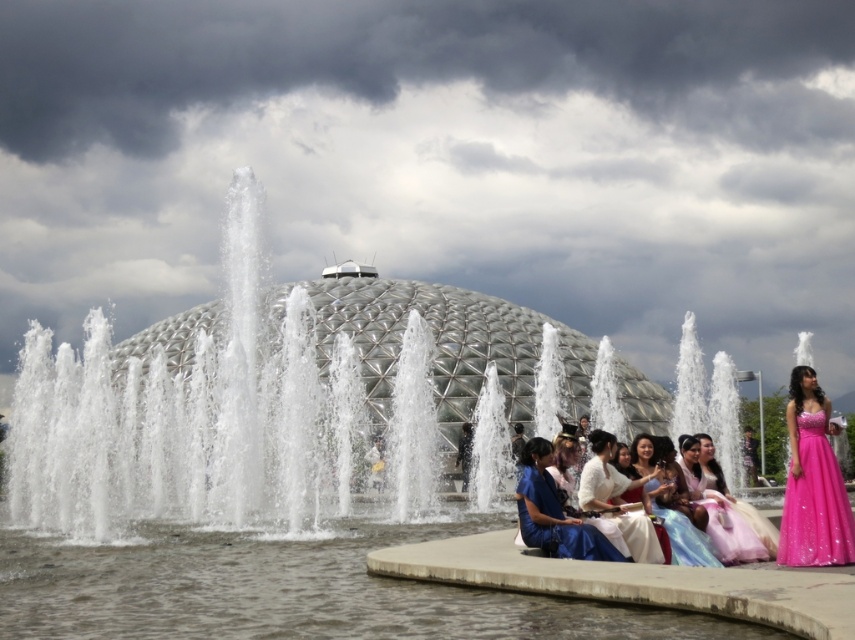
You are a photographer at the event and need to arrange the two dresses in a way that the thinner one is placed to the left of the wider one. Given their current positions, is the pink sequined dress at right already positioned correctly relative to the blue satin dress at center?

The pink sequined dress at right is thinner than the blue satin dress at center. To have the thinner one to the left of the wider one, the pink sequined dress at right should be moved to the left side so it is positioned to the left of the blue satin dress at center. Currently, it is on the right, so it is not correctly positioned.

You are a photographer trying to capture the perfect shot of the pink sequined dress at right. Based on its position coordinates, where should you aim your camera to ensure the dress is centered in your frame?

The pink sequined dress at right is located at coordinates point (815,500), so you should aim your camera towards that point to center it in the frame.

You are a photographer at the event and need to capture a photo that includes both the pink sequined dress at right and the white satin dress at center. Based on their positions, which dress should you focus on first to ensure both are in frame?

The pink sequined dress at right is located above the white satin dress at center, so focusing on the white satin dress at center first will ensure both dresses are within the frame as the pink one is positioned higher up.